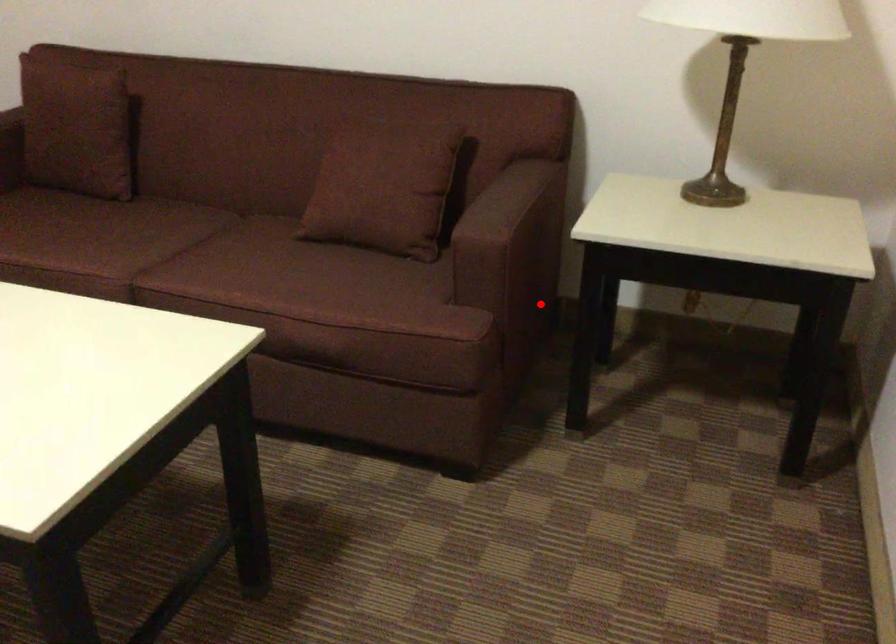
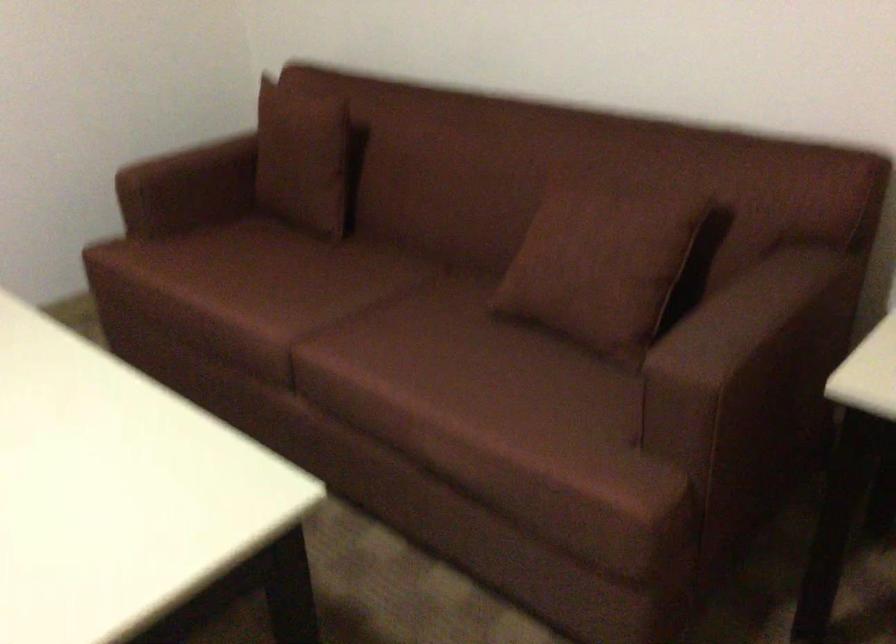
Find the pixel in the second image that matches the highlighted location in the first image.

(791, 446)